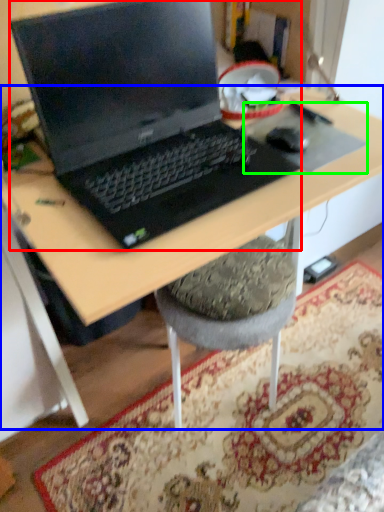
Question: Which object is the farthest from laptop (highlighted by a red box)? Choose among these: desk (highlighted by a blue box) or mousepad (highlighted by a green box).

Choices:
 (A) desk
 (B) mousepad

Answer: (B)